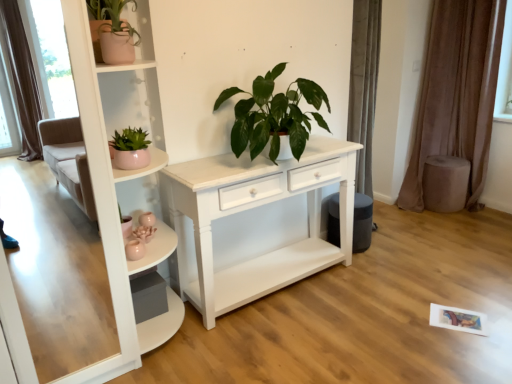
Where is `free spot in front of brown velvet curtain at right`? The width and height of the screenshot is (512, 384). free spot in front of brown velvet curtain at right is located at coordinates (477, 218).